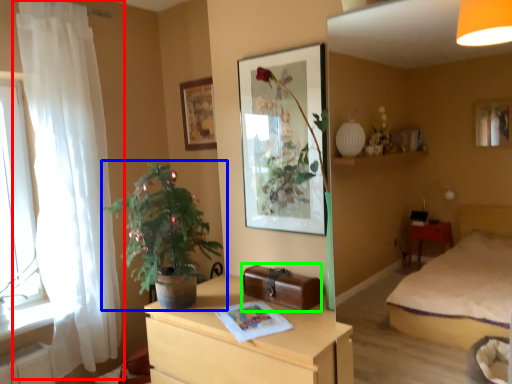
Question: Considering the real-world distances, which object is farthest from curtain (highlighted by a red box)? houseplant (highlighted by a blue box) or luggage (highlighted by a green box)?

Choices:
 (A) houseplant
 (B) luggage

Answer: (B)